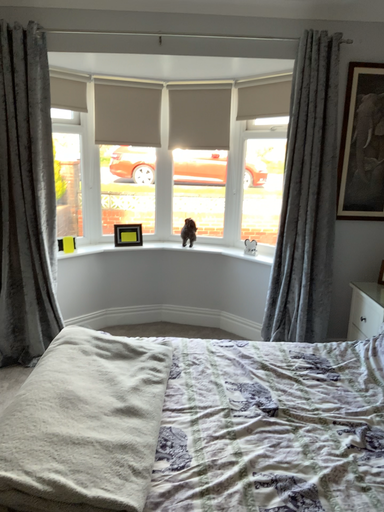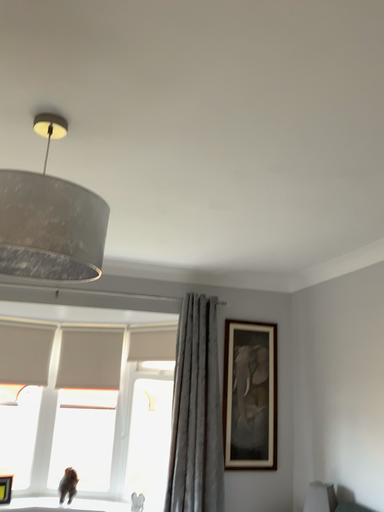
Question: How did the camera likely rotate when shooting the video?

Choices:
 (A) rotated downward
 (B) rotated upward

Answer: (B)